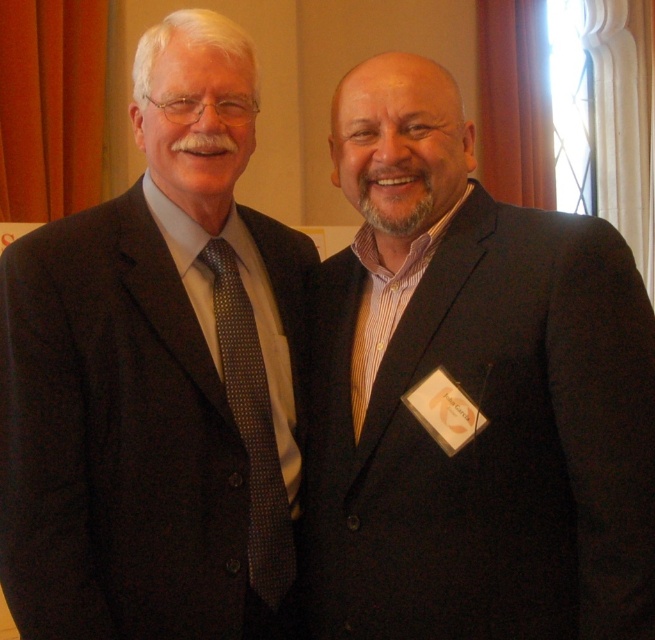
You are a photographer standing at the back of the room. You want to take a photo of both the matte black suit at center and the matte black suit at left. The camera you are using has a minimum focus distance of 15 inches. Will you be able to capture both suits clearly in the same frame without moving closer?

The distance between the matte black suit at center and the matte black suit at left is 14.75 inches, which is less than the camera minimum focus distance of 15 inches. Therefore, you can capture both suits clearly in the same frame without moving closer.